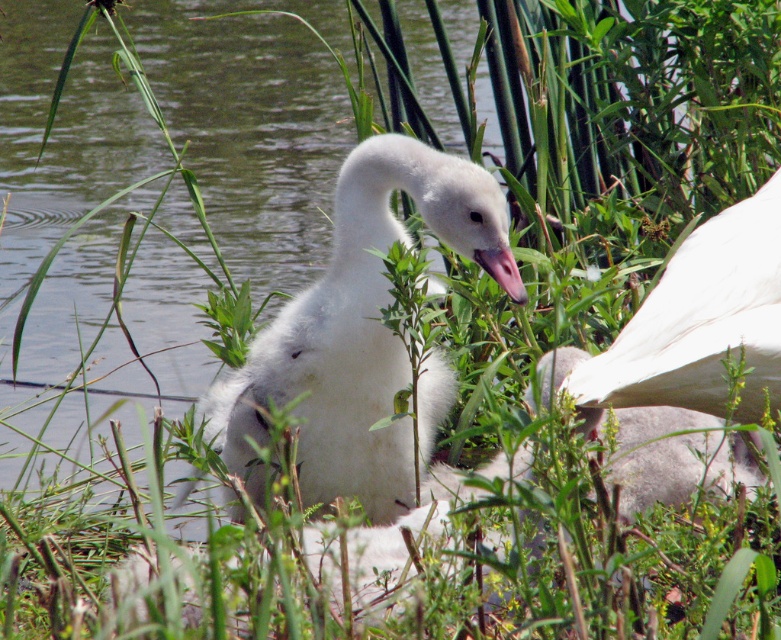
In the serene natural scene with the swan and cygnets, where is the white fluffy duck at upper right relative to the pink glossy beak at center?

The white fluffy duck at upper right is to the right of the pink glossy beak at center.

You are a birdwatcher observing the white fluffy swan at center and the pink glossy beak at center. Which object is taller?

The white fluffy swan at center is taller than the pink glossy beak at center.

From the picture: You are standing at the origin point in the scene. Which of the two points, point [332,336] or point [478,259], is closer to you?

Point [478,259] is closer to you because it is in front of point [332,336].